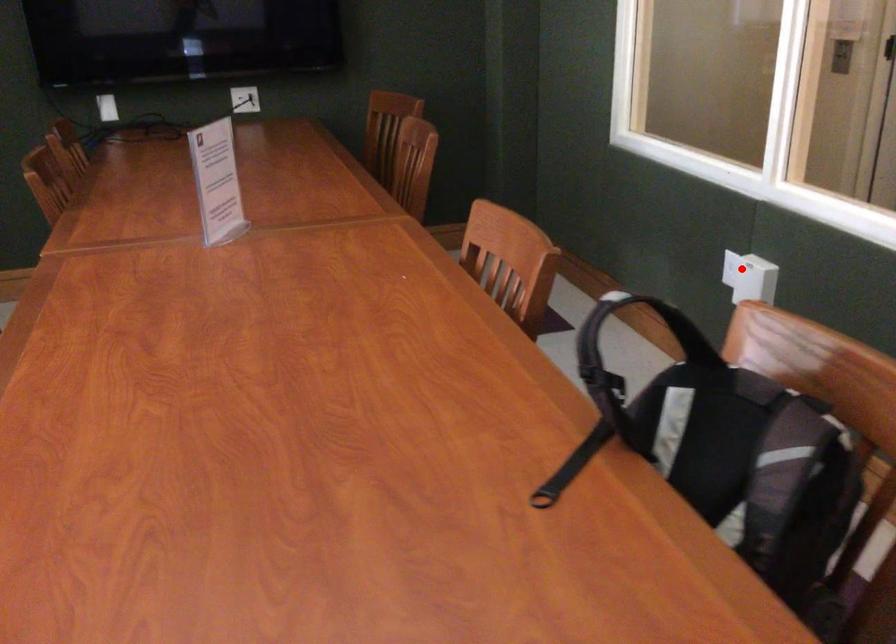
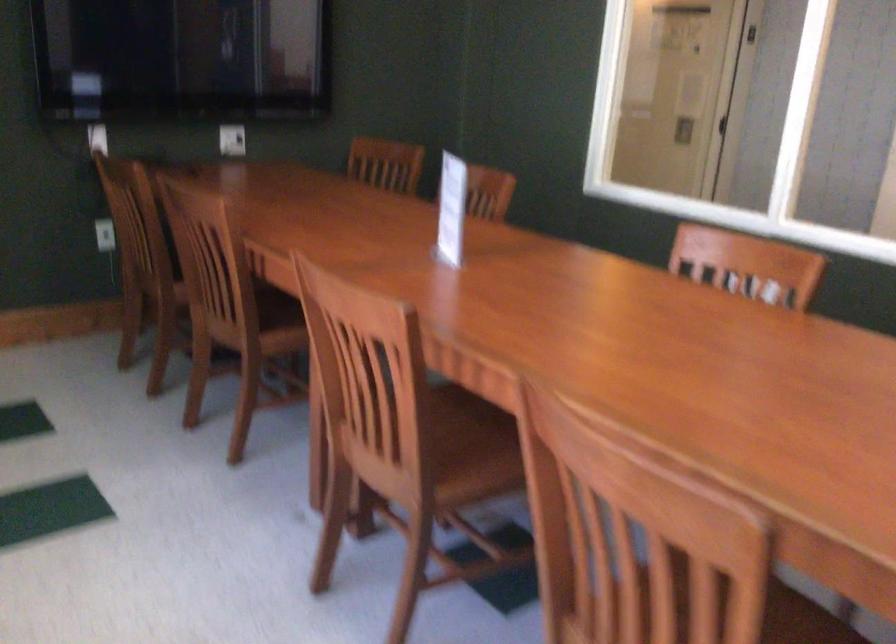
Question: I am providing you with two images of the same scene from different viewpoints. A red point is marked on the first image. At the location where the point appears in image 1, is it still visible in image 2?

Choices:
 (A) Yes
 (B) No

Answer: (B)